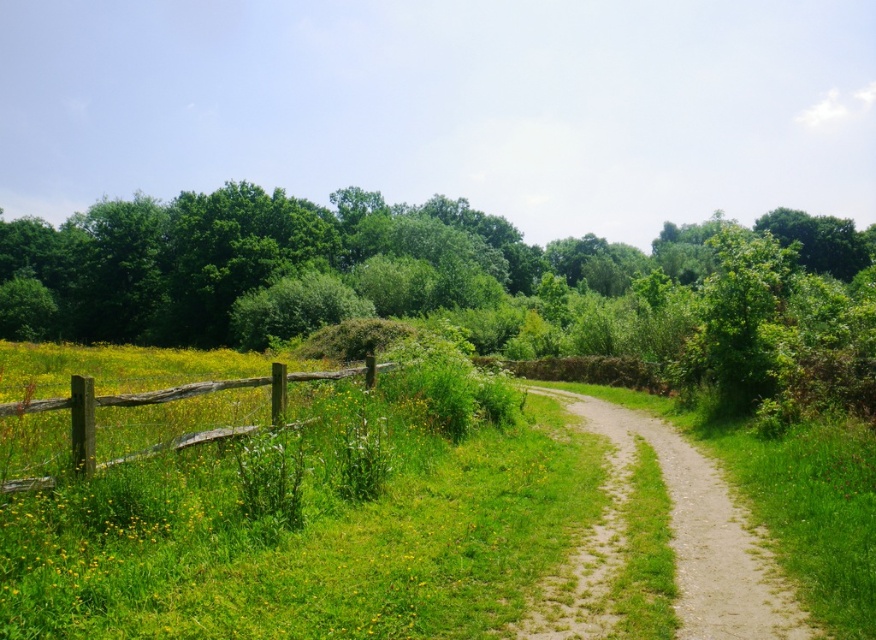
Which of these two, green leafy tree at center or weathered wood fence at left, stands shorter?

weathered wood fence at left is shorter.

You are a GUI agent. You are given a task and a screenshot of the screen. Output one action in this format:
    pyautogui.click(x=<x>, y=<y>)
    Task: Click on the green leafy tree at center
    This screenshot has width=876, height=640.
    Given the screenshot: What is the action you would take?
    pyautogui.click(x=322, y=272)

Is dirt/gravel path at center in front of weathered wood fence at left?

That is True.

Is point (666, 481) farther from viewer compared to point (86, 452)?

Yes, it is behind point (86, 452).

This screenshot has width=876, height=640. In order to click on dirt/gravel path at center in this screenshot , I will do `click(670, 544)`.

Identify the location of dirt/gravel path at center. This screenshot has height=640, width=876. (670, 544).

Can you confirm if green leafy tree at center is taller than dirt/gravel path at center?

Correct, green leafy tree at center is much taller as dirt/gravel path at center.

Locate an element on the screen. green leafy tree at center is located at coordinates (322, 272).